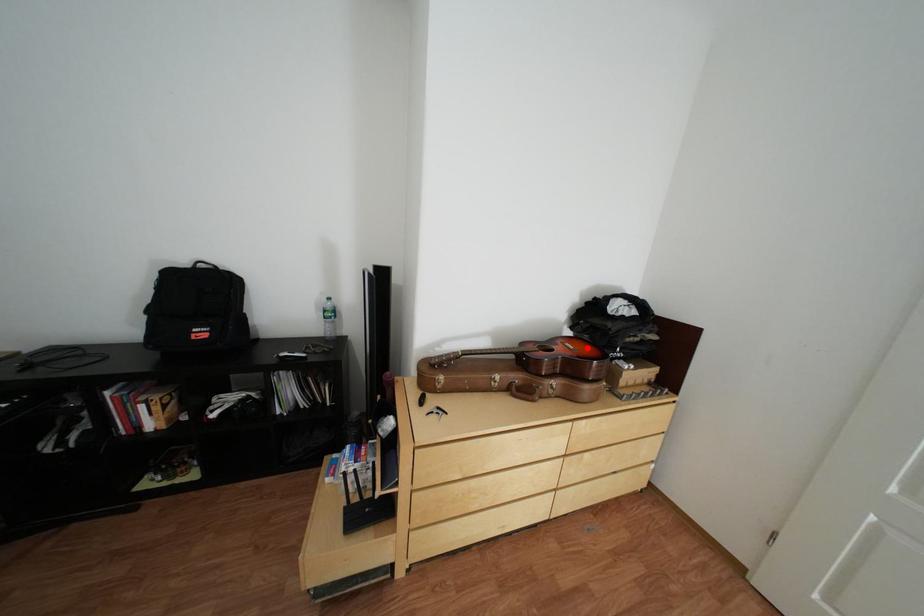
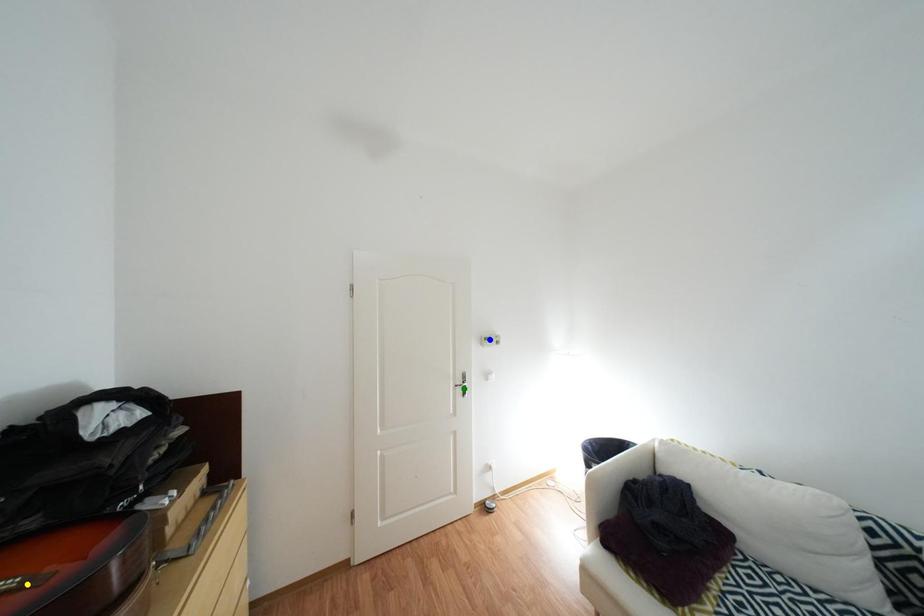
Question: I am providing you with two images of the same scene from different viewpoints. A red point is marked on the first image. You are given multiple points on the second image. Which mark in image 2 goes with the point in image 1?

Choices:
 (A) yellow point
 (B) green point
 (C) blue point

Answer: (A)